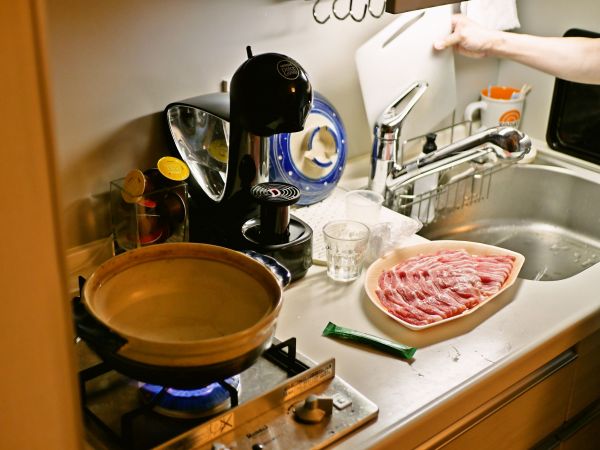
Where is `mug`? mug is located at coordinates (507, 111).